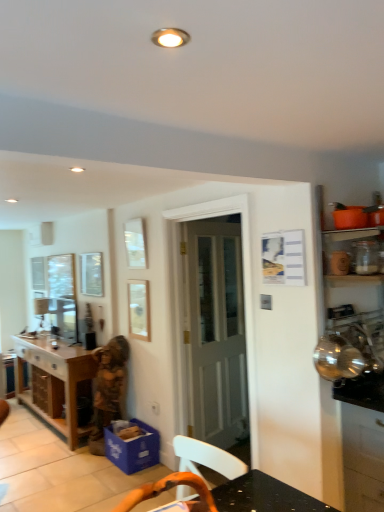
Question: From their relative heights in the image, would you say white wooden door at center is taller or shorter than translucent glass jar at upper right?

Choices:
 (A) tall
 (B) short

Answer: (A)

Question: Would you say white wooden door at center is to the left or to the right of translucent glass jar at upper right in the picture?

Choices:
 (A) right
 (B) left

Answer: (B)

Question: Estimate the real-world distances between objects in this image. Which object is farther from the white wooden door at center?

Choices:
 (A) blue cardboard box at lower center, the 1th cabinetry when ordered from back to front
 (B) wooden picture frame at center
 (C) wooden statue at center
 (D) satin black cabinet at right, marked as the 2th cabinetry in a back-to-front arrangement
 (E) wooden table at lower left

Answer: (D)

Question: Estimate the real-world distances between objects in this image. Which object is closer to the wooden statue at center?

Choices:
 (A) translucent glass jar at upper right
 (B) white wooden door at center
 (C) wooden table at lower left
 (D) satin black cabinet at right, marked as the 2th cabinetry in a back-to-front arrangement
 (E) blue cardboard box at lower center, positioned as the 2th cabinetry in right-to-left order

Answer: (E)